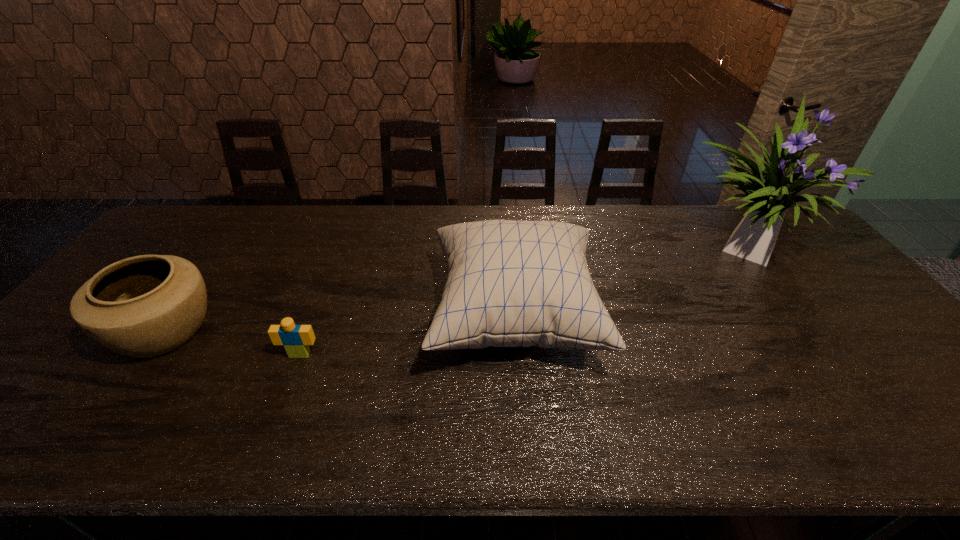
Find the location of `the rightmost object`. the rightmost object is located at coordinates (772, 188).

Locate an element on the screen. The width and height of the screenshot is (960, 540). flower arrangement is located at coordinates (772, 188).

Find the location of a particular element. cushion is located at coordinates (509, 283).

Where is `the second tallest object`? the second tallest object is located at coordinates (509, 283).

The width and height of the screenshot is (960, 540). In order to click on the leftmost object in this screenshot , I will do `click(143, 306)`.

Image resolution: width=960 pixels, height=540 pixels. What are the coordinates of `the second shortest object` in the screenshot? It's located at (143, 306).

Find the location of `Lego`. Lego is located at coordinates (296, 339).

You are a GUI agent. You are given a task and a screenshot of the screen. Output one action in this format:
    pyautogui.click(x=<x>, y=<y>)
    Task: Click on the third object from right to left
    The height and width of the screenshot is (540, 960).
    Given the screenshot: What is the action you would take?
    pyautogui.click(x=296, y=339)

The width and height of the screenshot is (960, 540). I want to click on vacant space situated 0.290m on the front of the tallest object, so click(835, 374).

This screenshot has height=540, width=960. Find the location of `vacant space positioned on the left of the second object from right to left`. vacant space positioned on the left of the second object from right to left is located at coordinates (393, 315).